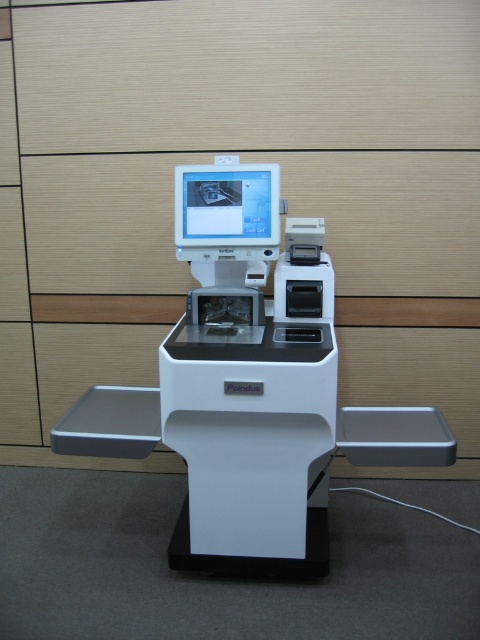
You are a delivery person who needs to place a package on the flat surface in front of the white plastic machine at center and the matte white monitor at center. Can you fit the package between them if it measures 10 inches in length?

The distance between the white plastic machine at center and the matte white monitor at center is 10.04 inches, so the package measuring 10 inches in length can fit between them.

You are standing in front of the kiosk and need to reach a point marked at coordinates point (365, 440). If your arm can extend 1.8 meters, can you comfortably reach that point without moving closer?

The distance of point (365, 440) from viewer is 2.06 meters. Since your arm can only extend 1.8 meters, you cannot comfortably reach that point without moving closer.